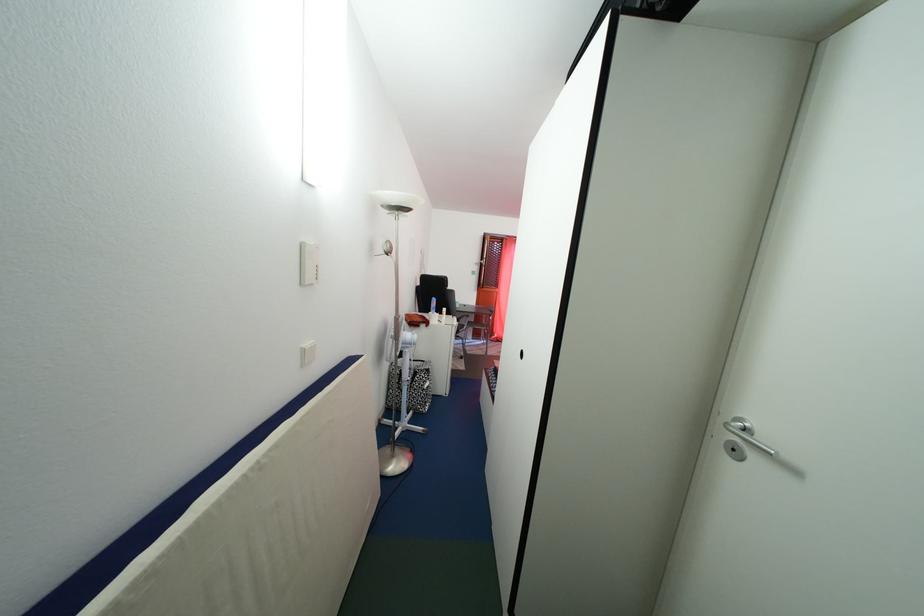
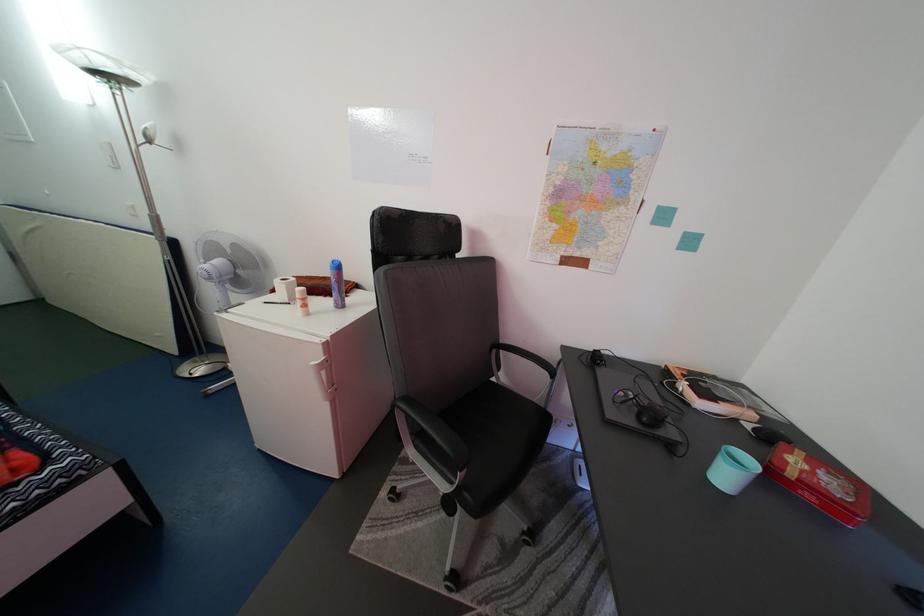
The point at (466, 313) is marked in the first image. Where is the corresponding point in the second image?

(735, 484)